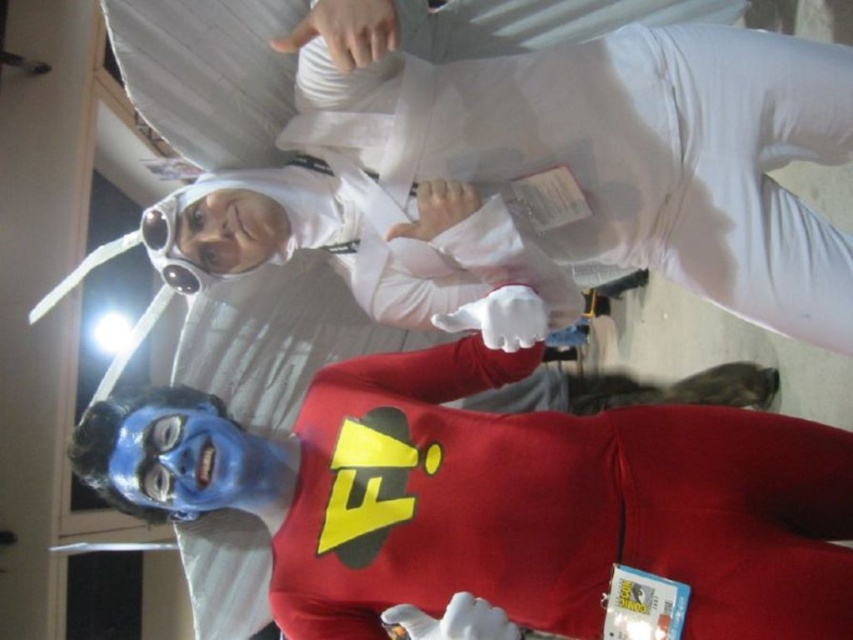
Question: Is the position of blue matte face paint at lower left less distant than that of white fabric costume at upper center?

Choices:
 (A) no
 (B) yes

Answer: (B)

Question: Is white fabric costume at upper center bigger than matte plastic goggles at upper left?

Choices:
 (A) no
 (B) yes

Answer: (B)

Question: Which of the following is the farthest from the observer?

Choices:
 (A) blue matte face paint at lower left
 (B) matte plastic goggles at upper left
 (C) white fabric costume at upper center

Answer: (B)

Question: Which point is closer to the camera?

Choices:
 (A) white fabric costume at upper center
 (B) matte plastic goggles at upper left
 (C) blue matte face paint at lower left

Answer: (C)

Question: Can you confirm if white fabric costume at upper center is wider than matte plastic goggles at upper left?

Choices:
 (A) yes
 (B) no

Answer: (A)

Question: Estimate the real-world distances between objects in this image. Which object is farther from the blue matte face paint at lower left?

Choices:
 (A) matte plastic goggles at upper left
 (B) white fabric costume at upper center

Answer: (A)